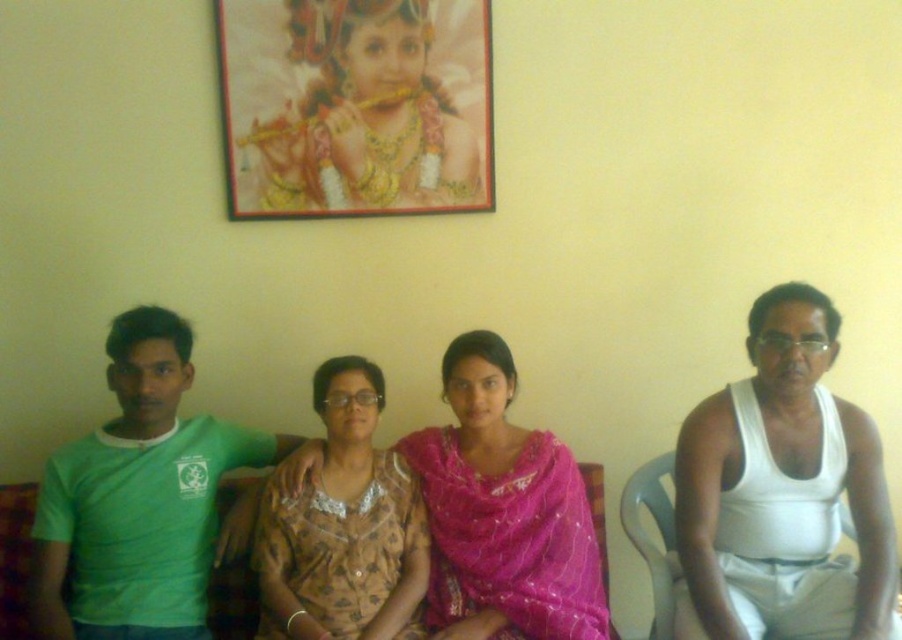
Does gold-framed portrait at upper center have a smaller size compared to pink satin saree at center?

Yes.

Which of these two, gold-framed portrait at upper center or pink satin saree at center, stands taller?

With more height is pink satin saree at center.

Measure the distance between gold-framed portrait at upper center and camera.

The distance of gold-framed portrait at upper center from camera is 7.50 feet.

The height and width of the screenshot is (640, 902). Find the location of `gold-framed portrait at upper center`. gold-framed portrait at upper center is located at coordinates (356, 106).

Is point (429, 449) closer to camera compared to point (419, 564)?

No, it is behind (419, 564).

Does pink satin saree at center lie behind brown printed dress at center?

Yes, it is.

Locate an element on the screen. The width and height of the screenshot is (902, 640). pink satin saree at center is located at coordinates (502, 513).

Is green matte t-shirt at left to the left of pink satin saree at center from the viewer's perspective?

Indeed, green matte t-shirt at left is positioned on the left side of pink satin saree at center.

What do you see at coordinates (137, 499) in the screenshot?
I see `green matte t-shirt at left` at bounding box center [137, 499].

Find the location of a particular element. green matte t-shirt at left is located at coordinates (137, 499).